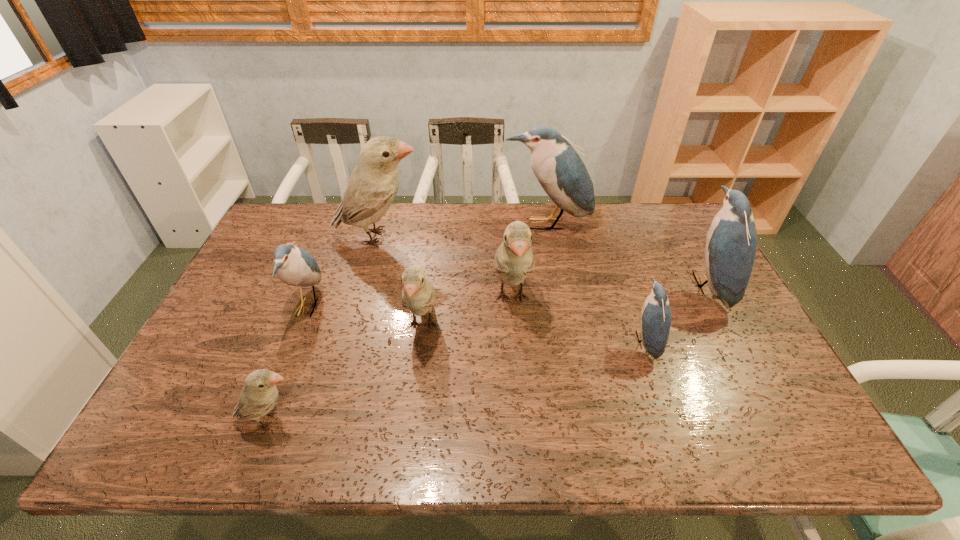
Where is `vacant area that lies between the rightmost object and the smallest white bird`? The image size is (960, 540). vacant area that lies between the rightmost object and the smallest white bird is located at coordinates (489, 353).

Identify the location of empty space between the second smallest white bird and the rightmost object. pyautogui.click(x=564, y=305).

Identify which object is located as the nearest to the third biggest white bird. Please provide its 2D coordinates. Your answer should be formatted as a tuple, i.e. [(x, y)], where the tuple contains the x and y coordinates of a point satisfying the conditions above.

[(514, 260)]

Where is `the third closest object to the third biggest white bird`? the third closest object to the third biggest white bird is located at coordinates (295, 266).

Choose which bird is the fifth nearest neighbor to the rightmost object. Please provide its 2D coordinates. Your answer should be formatted as a tuple, i.e. [(x, y)], where the tuple contains the x and y coordinates of a point satisfying the conditions above.

[(372, 187)]

I want to click on bird object that ranks as the fourth closest to the farthest blue bird, so click(x=418, y=295).

Where is `blue bird that stands as the third closest to the farthest blue bird`? blue bird that stands as the third closest to the farthest blue bird is located at coordinates (295, 266).

Locate an element on the screen. blue bird that stands as the second closest to the nearest white bird is located at coordinates (562, 174).

Select which white bird appears as the closest to the third blue bird from left to right. Please provide its 2D coordinates. Your answer should be formatted as a tuple, i.e. [(x, y)], where the tuple contains the x and y coordinates of a point satisfying the conditions above.

[(514, 260)]

Identify which white bird is located as the third nearest to the nearest white bird. Please provide its 2D coordinates. Your answer should be formatted as a tuple, i.e. [(x, y)], where the tuple contains the x and y coordinates of a point satisfying the conditions above.

[(372, 187)]